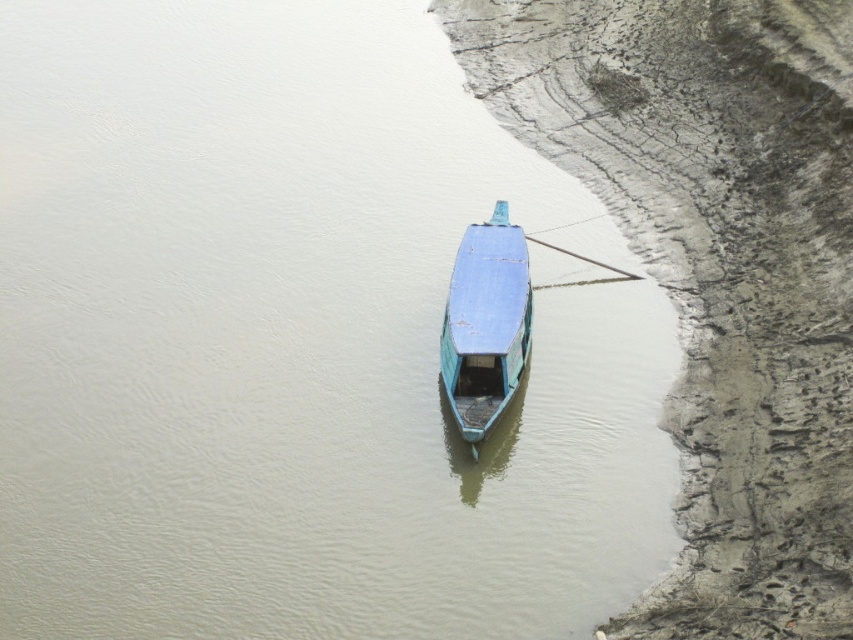
Is muddy dirt river bank at lower right bigger than blue matte boat at center?

Yes.

Is muddy dirt river bank at lower right smaller than blue matte boat at center?

Incorrect, muddy dirt river bank at lower right is not smaller in size than blue matte boat at center.

Which is in front, point (822, 221) or point (462, 422)?

Point (462, 422) is in front.

This screenshot has height=640, width=853. In order to click on muddy dirt river bank at lower right in this screenshot , I will do click(715, 266).